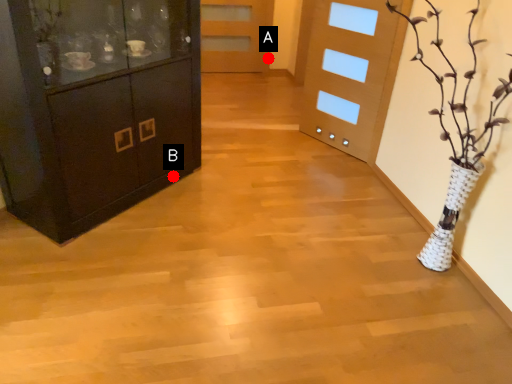
Question: Two points are circled on the image, labeled by A and B beside each circle. Which point is farther from the camera taking this photo?

Choices:
 (A) A is further
 (B) B is further

Answer: (A)